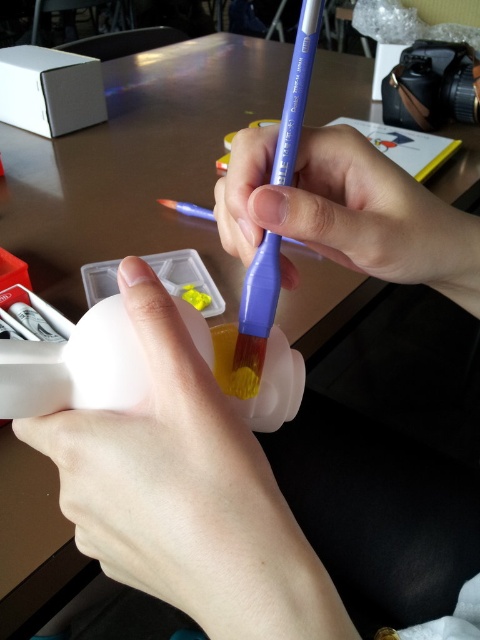
You are an artist trying to choose a paintbrush for a large area. You have two options on the table, the white matte paintbrush at center and the purple plastic paint brush at center. Which one should you pick?

The white matte paintbrush at center has a larger size compared to the purple plastic paint brush at center, so you should pick the white matte paintbrush at center for covering large areas.

You are an artist holding a paintbrush with a purple handle and bristle tip dipped into a small transparent container with a white lid partially open, which contains yellow paint. You need to reach a point that is 13.35 inches away from your current position at point (253, 244). Can you safely extend your arm to reach that point without knocking over the red box with white objects on the left side of the table?

The distance between the point (253, 244) and the viewer is 13.35 inches. Since the red box with white objects is on the left side of the table, you need to assess if extending your arm 13.35 inches towards the point would interfere with the box. However, without knowing the exact position and size of the red box, it is uncertain if the reach is safe. Consider checking the box placement before extending your arm.